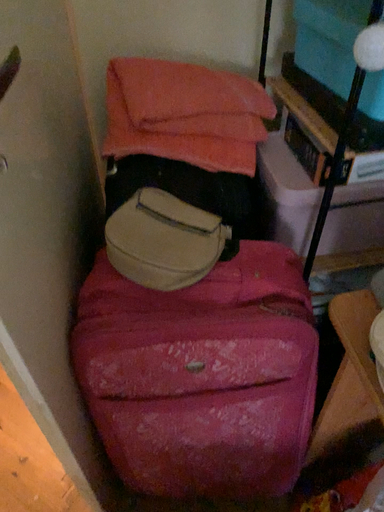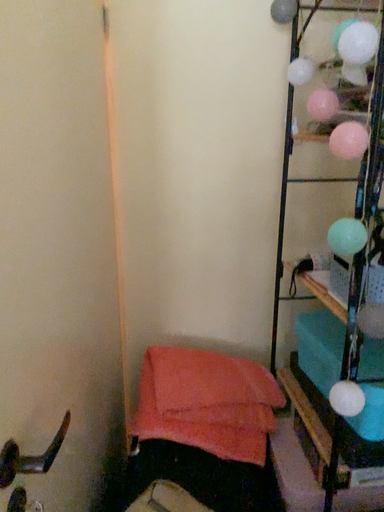
Question: Which way did the camera rotate in the video?

Choices:
 (A) rotated downward
 (B) rotated upward

Answer: (B)